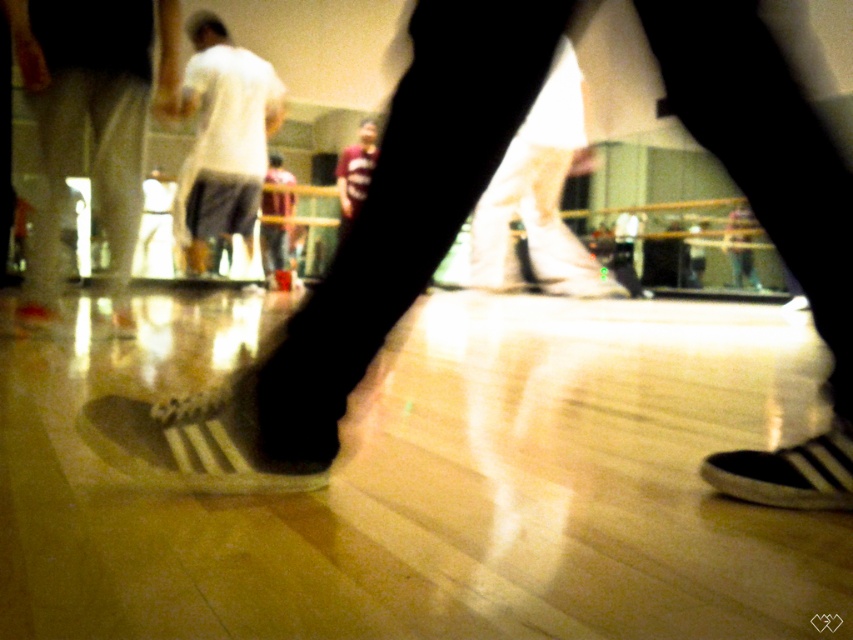
Question: Does white matte sneakers at center appear on the left side of white matte shirt at center?

Choices:
 (A) no
 (B) yes

Answer: (A)

Question: Considering the real-world distances, which object is farthest from the white matte sneaker at lower center?

Choices:
 (A) white matte shirt at center
 (B) maroon jersey at center

Answer: (B)

Question: Estimate the real-world distances between objects in this image. Which object is closer to the maroon jersey at center?

Choices:
 (A) white matte sneaker at lower center
 (B) white matte shirt at center
 (C) white matte sneakers at center

Answer: (B)

Question: Can you confirm if white matte sneaker at lower center is smaller than maroon jersey at center?

Choices:
 (A) no
 (B) yes

Answer: (B)

Question: Which object is the farthest from the black suede shoe at lower right?

Choices:
 (A) reddish-brown leather jacket at center
 (B) maroon jersey at center

Answer: (A)

Question: In this image, where is white matte shirt at center located relative to maroon jersey at center?

Choices:
 (A) above
 (B) below

Answer: (B)